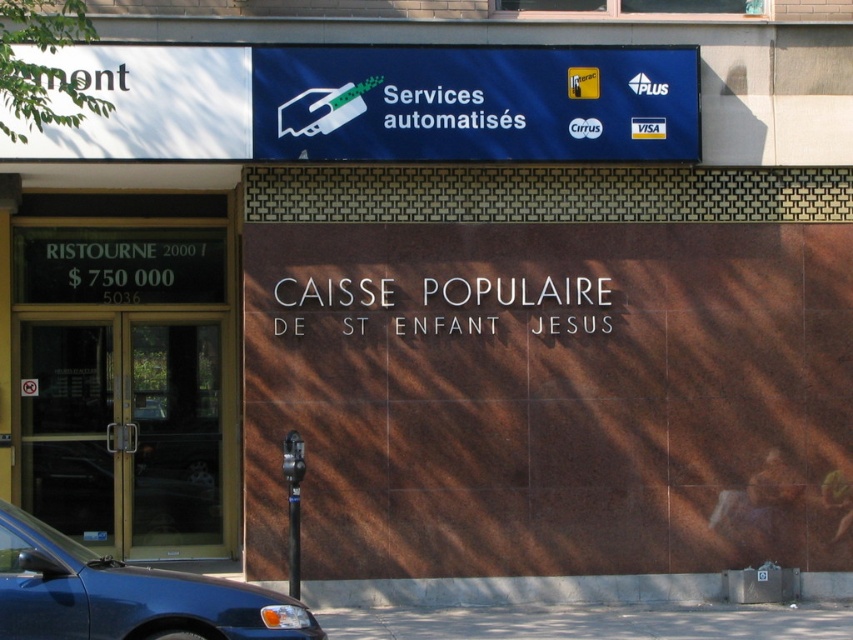
Does point (41, 417) lie in front of point (292, 586)?

No, it is behind (292, 586).

Does gold metallic door at left appear on the left side of metallic parking sign at lower center?

Yes, gold metallic door at left is to the left of metallic parking sign at lower center.

What do you see at coordinates (125, 433) in the screenshot?
I see `gold metallic door at left` at bounding box center [125, 433].

The image size is (853, 640). I want to click on gold metallic door at left, so click(125, 433).

Is blue fabric sign at upper center taller than metallic blue car at lower left?

Yes, blue fabric sign at upper center is taller than metallic blue car at lower left.

Is blue fabric sign at upper center smaller than metallic blue car at lower left?

No.

Locate an element on the screen. This screenshot has width=853, height=640. blue fabric sign at upper center is located at coordinates (474, 104).

Between gold metallic door at left and metallic blue car at lower left, which one is positioned higher?

gold metallic door at left

Who is taller, gold metallic door at left or metallic blue car at lower left?

gold metallic door at left is taller.

Between point (157, 499) and point (126, 589), which one is positioned in front?

Point (126, 589) is more forward.

The width and height of the screenshot is (853, 640). I want to click on gold metallic door at left, so click(125, 433).